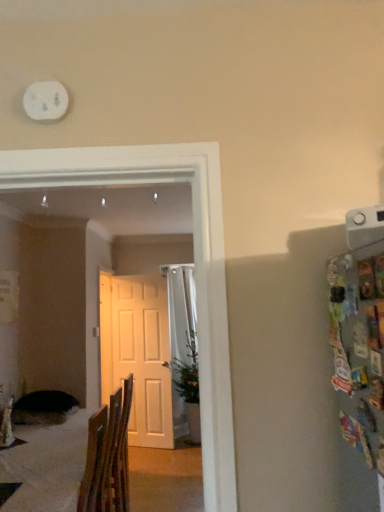
Question: Is white matte door at center thinner than wooden chair at lower left?

Choices:
 (A) yes
 (B) no

Answer: (A)

Question: Considering the relative sizes of white matte door at center and wooden chair at lower left in the image provided, is white matte door at center shorter than wooden chair at lower left?

Choices:
 (A) yes
 (B) no

Answer: (B)

Question: Considering the relative sizes of white matte door at center and wooden chair at lower left in the image provided, is white matte door at center bigger than wooden chair at lower left?

Choices:
 (A) no
 (B) yes

Answer: (A)

Question: Considering the relative sizes of white matte door at center and wooden chair at lower left in the image provided, is white matte door at center wider than wooden chair at lower left?

Choices:
 (A) yes
 (B) no

Answer: (B)

Question: Does white matte door at center have a smaller size compared to wooden chair at lower left?

Choices:
 (A) yes
 (B) no

Answer: (A)

Question: Is white matte door at center to the left of wooden chair at lower left from the viewer's perspective?

Choices:
 (A) yes
 (B) no

Answer: (B)

Question: Considering the relative sizes of wooden chair at lower left and green leafy plant at center in the image provided, is wooden chair at lower left taller than green leafy plant at center?

Choices:
 (A) yes
 (B) no

Answer: (B)

Question: From the image's perspective, is wooden chair at lower left located beneath green leafy plant at center?

Choices:
 (A) no
 (B) yes

Answer: (A)

Question: Is wooden chair at lower left surrounding green leafy plant at center?

Choices:
 (A) no
 (B) yes

Answer: (A)

Question: From a real-world perspective, is wooden chair at lower left positioned under green leafy plant at center based on gravity?

Choices:
 (A) no
 (B) yes

Answer: (B)

Question: Is wooden chair at lower left to the right of green leafy plant at center from the viewer's perspective?

Choices:
 (A) no
 (B) yes

Answer: (A)

Question: From a real-world perspective, is wooden chair at lower left positioned over green leafy plant at center based on gravity?

Choices:
 (A) yes
 (B) no

Answer: (B)

Question: Can you confirm if green leafy plant at center is shorter than wooden chair at lower left?

Choices:
 (A) no
 (B) yes

Answer: (A)